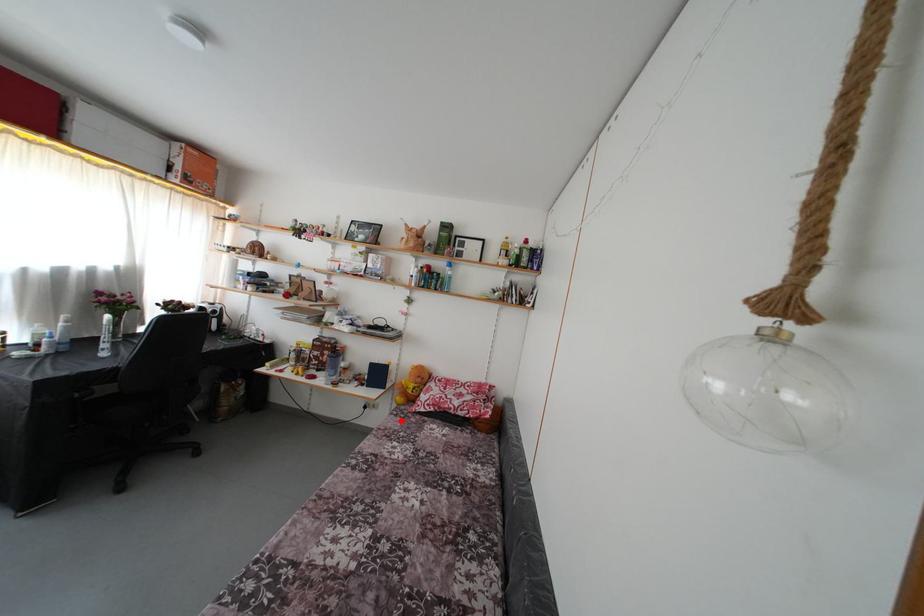
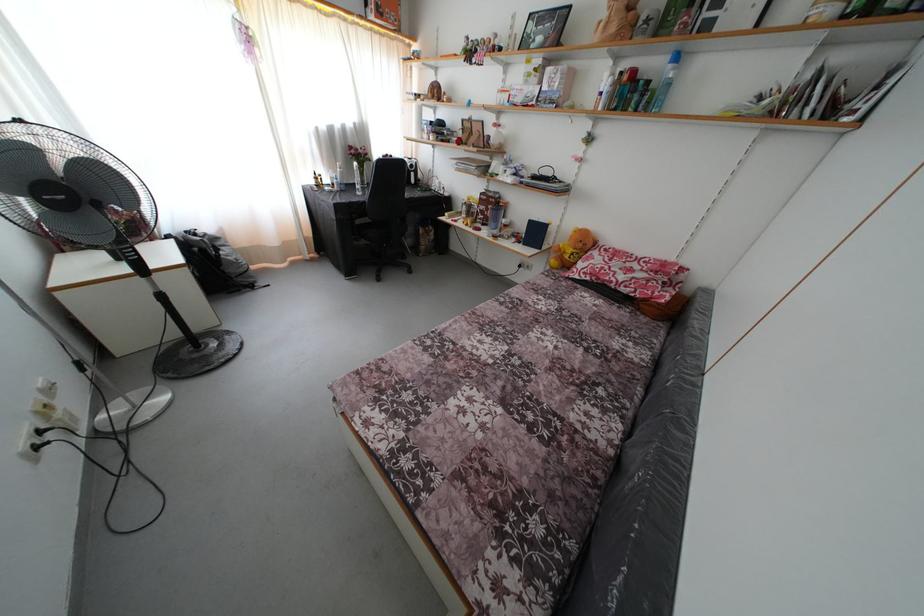
Question: I am providing you with two images of the same scene from different viewpoints. In image1, a red point is highlighted. Considering the same 3D point in image2, which of the following is correct?

Choices:
 (A) It is closer
 (B) It is farther

Answer: (A)